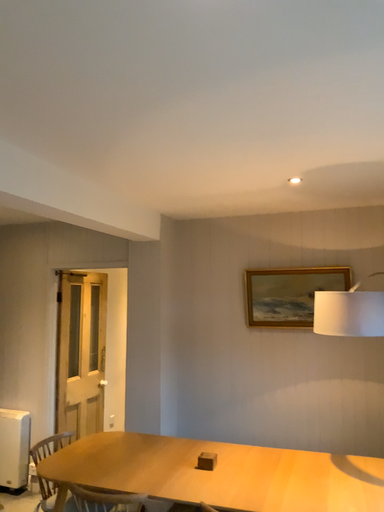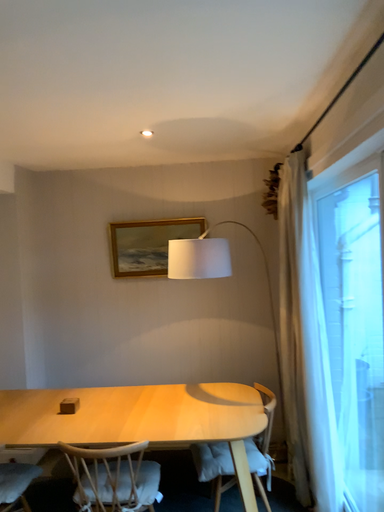
Question: How did the camera likely rotate when shooting the video?

Choices:
 (A) rotated right
 (B) rotated left

Answer: (A)